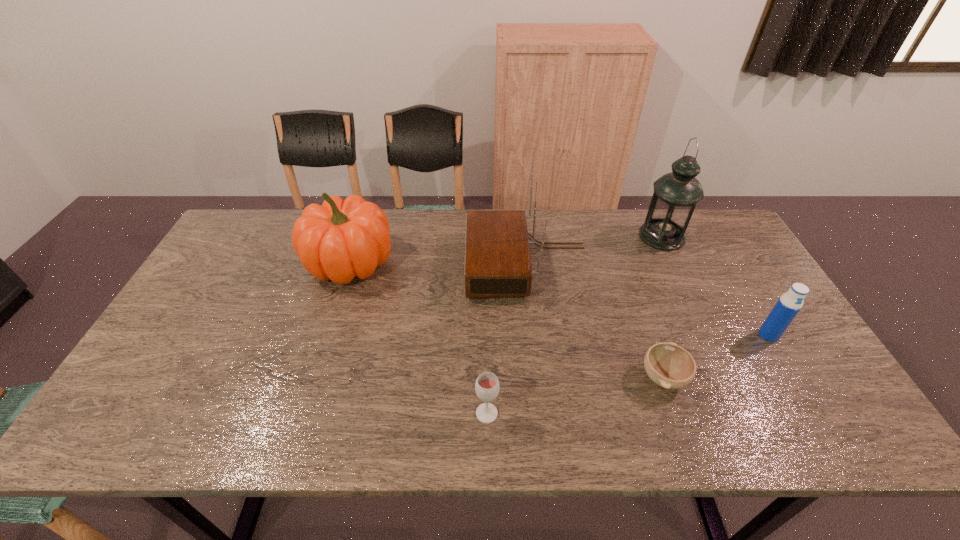
Identify the location of vacant space that's between the third object from right to left and the fifth object from left to right. This screenshot has width=960, height=540. (662, 307).

The height and width of the screenshot is (540, 960). What are the coordinates of `vacant area that lies between the tallest object and the radio_receiver` in the screenshot? It's located at (594, 250).

This screenshot has width=960, height=540. What are the coordinates of `vacant space that is in between the tallest object and the wineglass` in the screenshot? It's located at (574, 325).

Where is `empty space that is in between the oil lamp and the bowl`? This screenshot has width=960, height=540. empty space that is in between the oil lamp and the bowl is located at coordinates (662, 307).

Identify the location of free space between the tallest object and the nearest object. The image size is (960, 540). (574, 325).

This screenshot has height=540, width=960. I want to click on free space between the fifth object from left to right and the radio_receiver, so click(x=594, y=250).

Where is `empty space that is in between the radio_receiver and the pumpkin`? The image size is (960, 540). empty space that is in between the radio_receiver and the pumpkin is located at coordinates (439, 263).

Locate an element on the screen. vacant area that lies between the bowl and the radio_receiver is located at coordinates (595, 320).

Image resolution: width=960 pixels, height=540 pixels. What are the coordinates of `vacant space that is in between the pumpkin and the shortest object` in the screenshot? It's located at (507, 320).

This screenshot has width=960, height=540. I want to click on vacant region between the radio_receiver and the second shortest object, so click(507, 339).